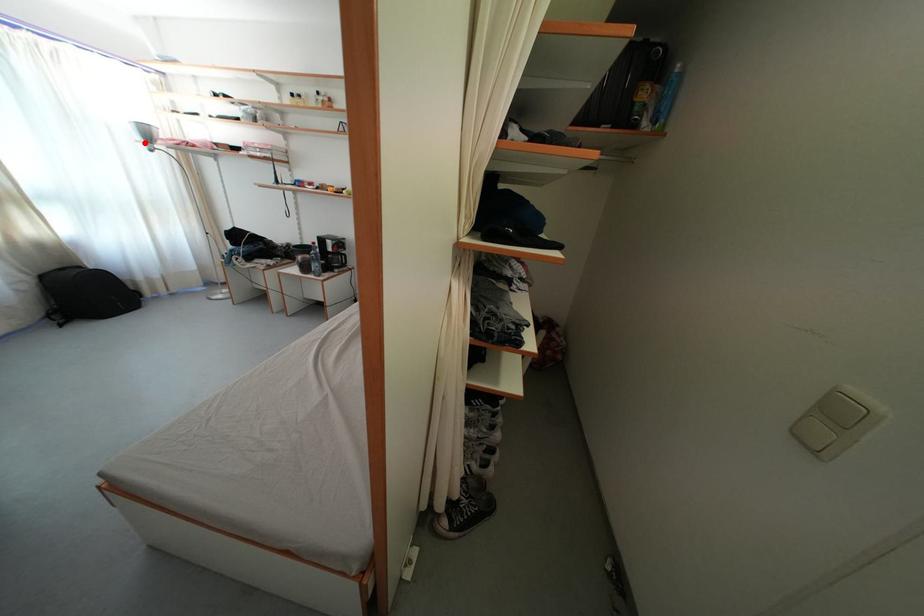
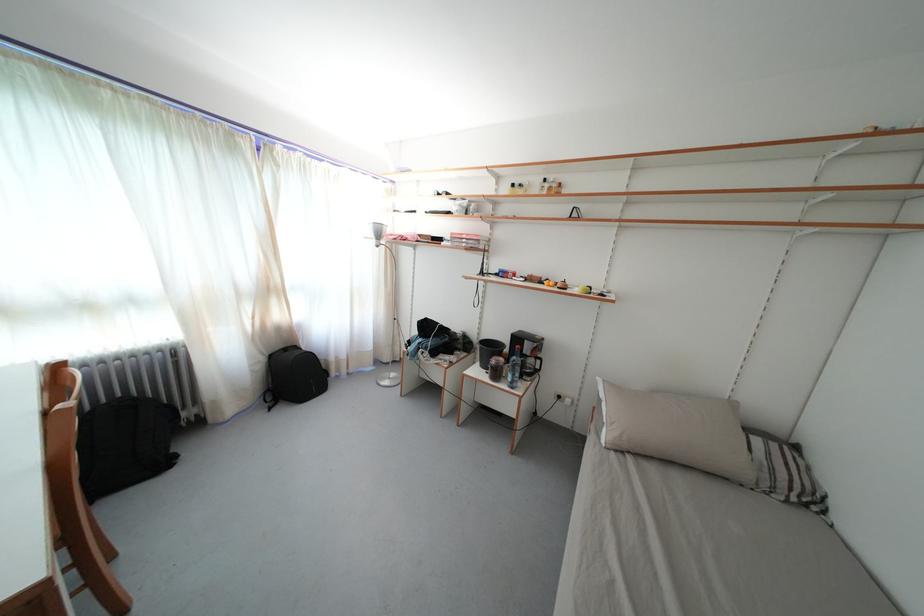
Locate, in the second image, the point that corresponds to the highlighted location in the first image.

(378, 241)